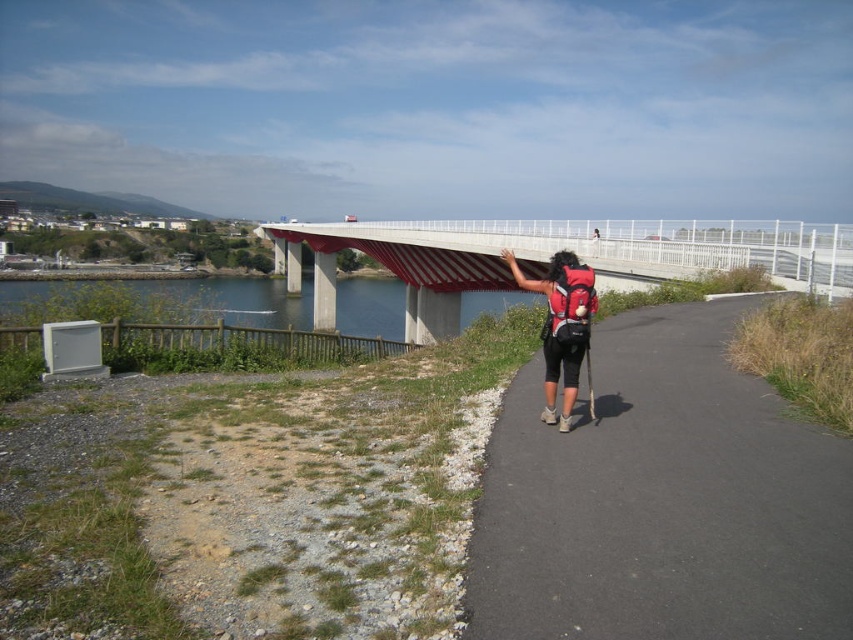
Can you confirm if black asphalt path at center is positioned to the left of concrete bridge at center?

In fact, black asphalt path at center is to the right of concrete bridge at center.

What do you see at coordinates (663, 499) in the screenshot? The height and width of the screenshot is (640, 853). I see `black asphalt path at center` at bounding box center [663, 499].

Measure the distance between black asphalt path at center and camera.

The distance of black asphalt path at center from camera is 3.03 meters.

Image resolution: width=853 pixels, height=640 pixels. What are the coordinates of `black asphalt path at center` in the screenshot? It's located at pos(663,499).

Is black asphalt path at center taller than matte red backpack at center?

No.

Does black asphalt path at center appear on the left side of matte red backpack at center?

Indeed, black asphalt path at center is positioned on the left side of matte red backpack at center.

Identify the location of black asphalt path at center. (663, 499).

The width and height of the screenshot is (853, 640). Find the location of `black asphalt path at center`. black asphalt path at center is located at coordinates (663, 499).

Which is in front, point (427, 227) or point (589, 276)?

Point (589, 276)

Is concrete bridge at center thinner than matte red backpack at center?

Incorrect, concrete bridge at center's width is not less than matte red backpack at center's.

Locate an element on the screen. Image resolution: width=853 pixels, height=640 pixels. concrete bridge at center is located at coordinates (549, 256).